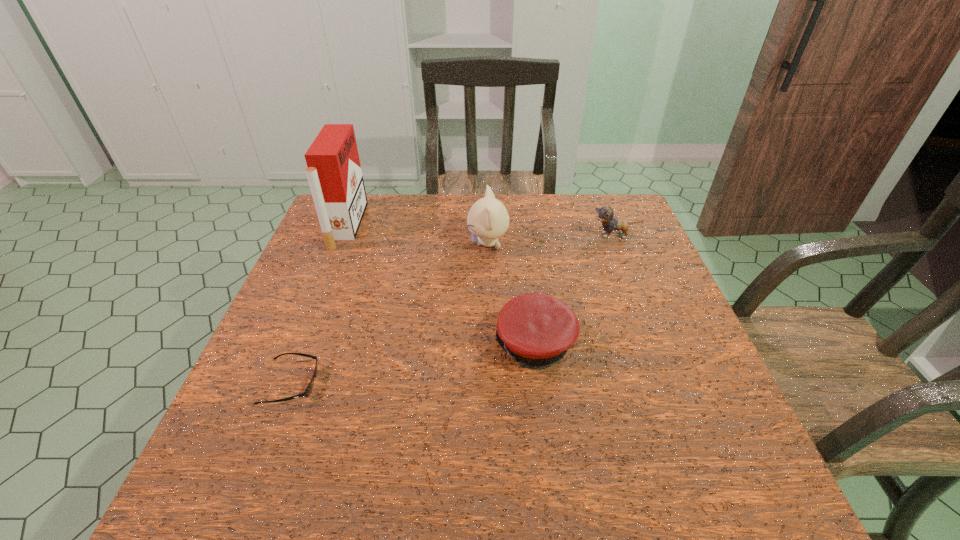
Locate which object is the second closest to the third tallest object. Please provide its 2D coordinates. Your answer should be formatted as a tuple, i.e. [(x, y)], where the tuple contains the x and y coordinates of a point satisfying the conditions above.

[(535, 329)]

Identify the location of object identified as the fourth closest to the sunglasses. (605, 214).